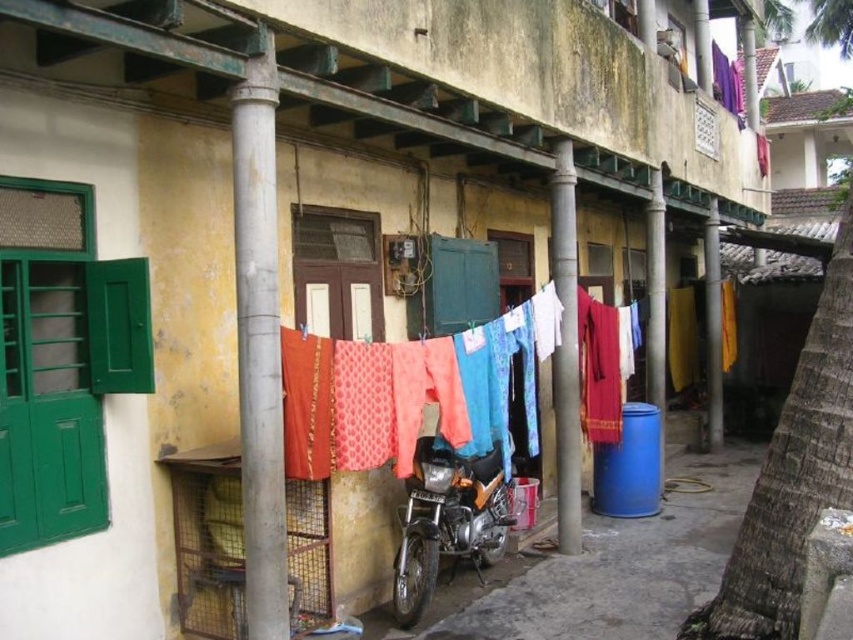
Is gray concrete pillar at center thinner than yellow fabric at right?

Indeed, gray concrete pillar at center has a lesser width compared to yellow fabric at right.

Who is more distant from viewer, (270,582) or (708,404)?

The point (708,404) is behind.

Where is `gray concrete pillar at center`? Image resolution: width=853 pixels, height=640 pixels. gray concrete pillar at center is located at coordinates (259, 342).

Is patterned fabric clothes at center further to the viewer compared to shiny metallic motorcycle at center?

No, it is in front of shiny metallic motorcycle at center.

Is point (363, 371) closer to camera compared to point (424, 436)?

Yes.

Find the location of a particular element. Image resolution: width=853 pixels, height=640 pixels. patterned fabric clothes at center is located at coordinates (364, 401).

Which is more to the left, smooth concrete pole at center or yellow fabric at right?

smooth concrete pole at center is more to the left.

Is smooth concrete pole at center below yellow fabric at right?

Correct, smooth concrete pole at center is located below yellow fabric at right.

Describe the element at coordinates (566, 349) in the screenshot. I see `smooth concrete pole at center` at that location.

Where is `smooth concrete pole at center`? This screenshot has height=640, width=853. smooth concrete pole at center is located at coordinates (566, 349).